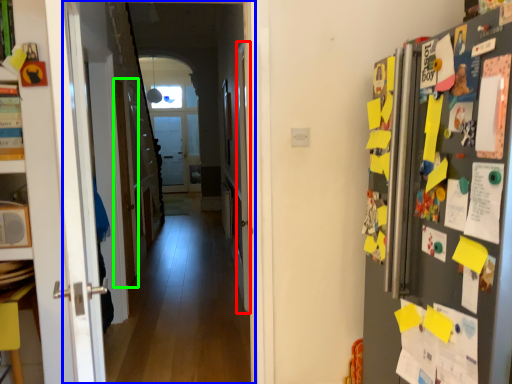
Question: Which object is positioned farthest from door (highlighted by a red box)? Select from corridor (highlighted by a blue box) and door (highlighted by a green box).

Choices:
 (A) corridor
 (B) door

Answer: (B)